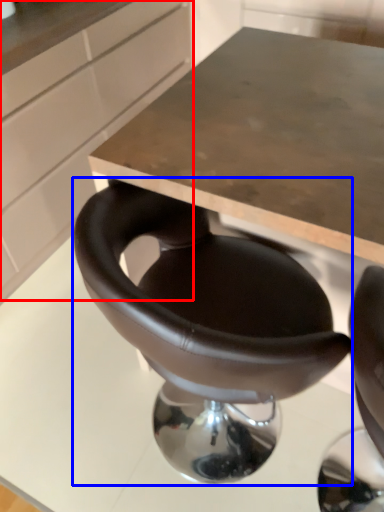
Question: Which object appears closest to the camera in this image, cabinetry (highlighted by a red box) or chair (highlighted by a blue box)?

Choices:
 (A) cabinetry
 (B) chair

Answer: (B)